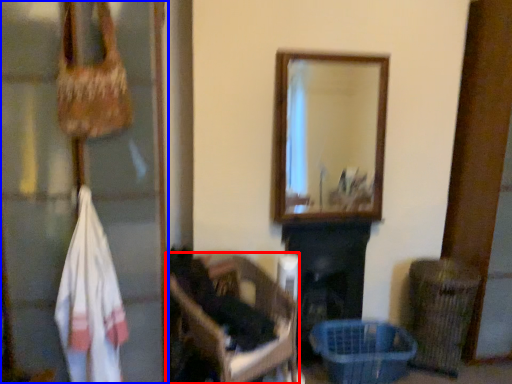
Question: Which object appears farthest to the camera in this image, furniture (highlighted by a red box) or glass door (highlighted by a blue box)?

Choices:
 (A) furniture
 (B) glass door

Answer: (A)